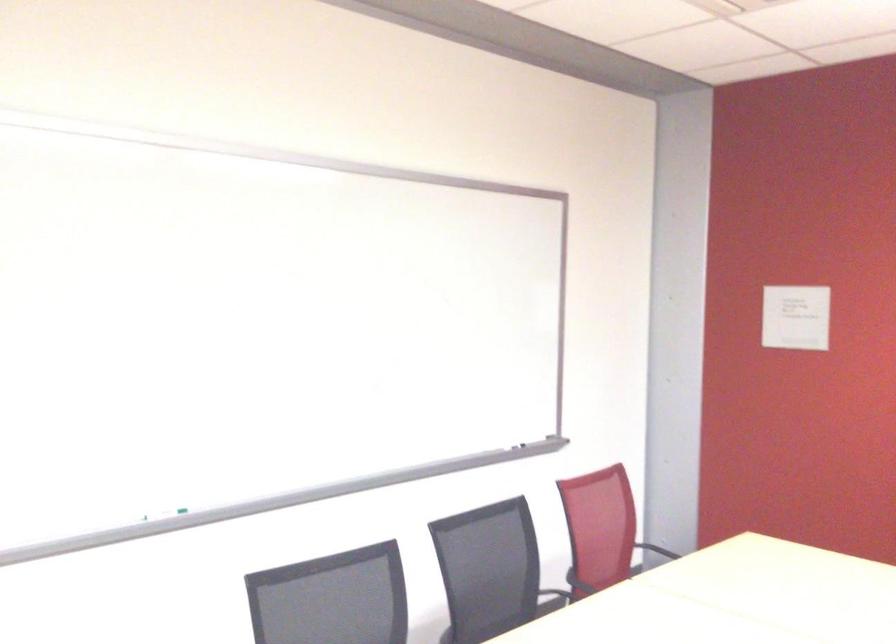
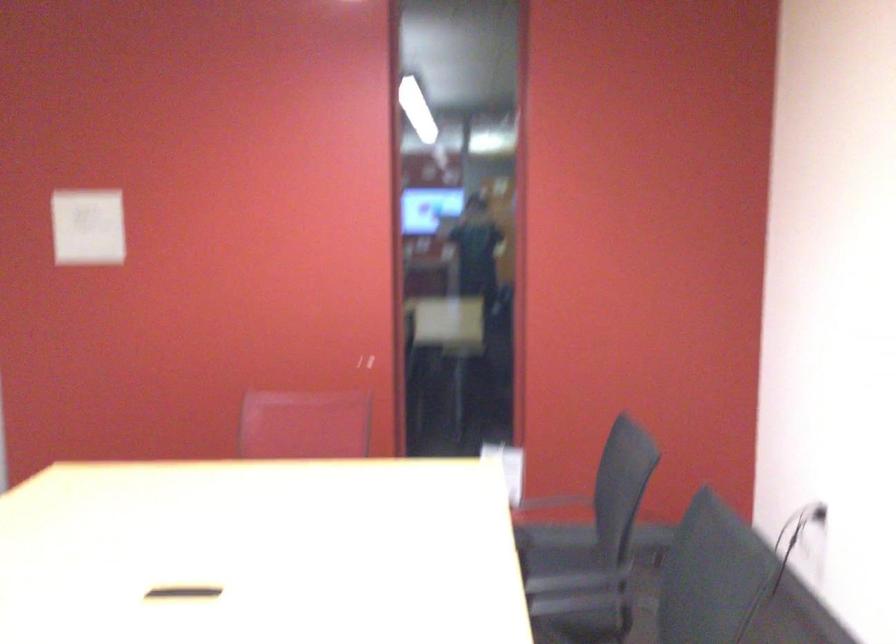
Question: The images are taken continuously from a first-person perspective. In which direction is your viewpoint rotating?

Choices:
 (A) Left
 (B) Right
 (C) Up
 (D) Down

Answer: (B)